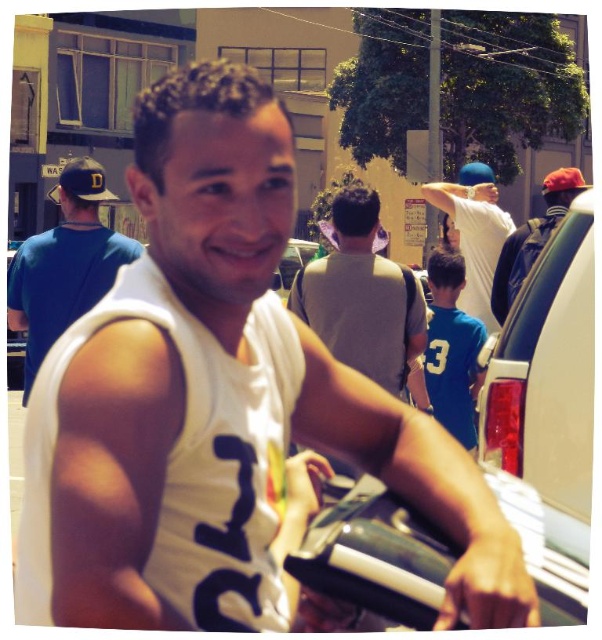
Question: Which of the following is the farthest from the observer?

Choices:
 (A) (450, 221)
 (B) (532, 232)
 (C) (368, 241)
 (D) (92, 186)

Answer: (A)

Question: Where is metallic silver car at center located in relation to white cotton t-shirt at upper right in the image?

Choices:
 (A) above
 (B) below

Answer: (B)

Question: Is blue cotton t-shirt at left thinner than white cotton t-shirt at upper right?

Choices:
 (A) no
 (B) yes

Answer: (A)

Question: Which of the following is the closest to the observer?

Choices:
 (A) (382, 262)
 (B) (492, 292)
 (C) (470, 310)

Answer: (A)

Question: Which is nearer to the metallic silver car at center?

Choices:
 (A) blue cotton t-shirt at left
 (B) gray cotton t-shirt at center
 (C) matte gray backpack at right
 (D) white cotton t-shirt at upper right

Answer: (B)

Question: Does metallic silver car at center appear on the left side of gray cotton t-shirt at center?

Choices:
 (A) yes
 (B) no

Answer: (B)